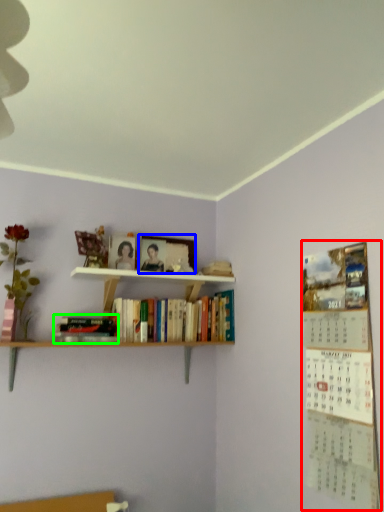
Question: Estimate the real-world distances between objects in this image. Which object is closer to bulletin board (highlighted by a red box), picture frame (highlighted by a blue box) or book (highlighted by a green box)?

Choices:
 (A) picture frame
 (B) book

Answer: (B)